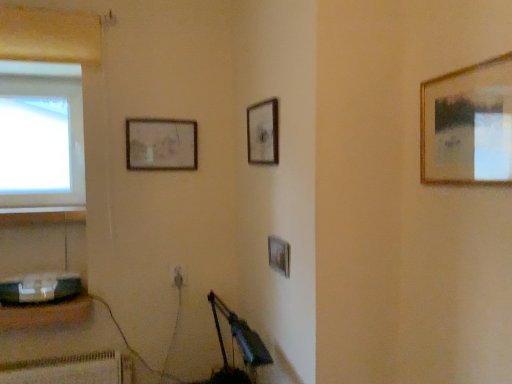
Question: Is metallic gray speaker at lower left smaller than matte wooden picture frame at upper center, placed as the fourth picture frame when sorted from front to back?

Choices:
 (A) no
 (B) yes

Answer: (A)

Question: Is metallic gray speaker at lower left further to the viewer compared to matte wooden picture frame at upper center, placed as the fourth picture frame when sorted from front to back?

Choices:
 (A) no
 (B) yes

Answer: (A)

Question: Does metallic gray speaker at lower left turn towards matte wooden picture frame at upper center, marked as the first picture frame in a left-to-right arrangement?

Choices:
 (A) yes
 (B) no

Answer: (B)

Question: Is metallic gray speaker at lower left taller than matte wooden picture frame at upper center, placed as the fourth picture frame when sorted from front to back?

Choices:
 (A) yes
 (B) no

Answer: (B)

Question: Does metallic gray speaker at lower left have a lesser width compared to matte wooden picture frame at upper center, which ranks as the fourth picture frame in right-to-left order?

Choices:
 (A) yes
 (B) no

Answer: (B)

Question: Considering the positions of wooden picture frame at center, which is the third picture frame in left-to-right order, and matte black toaster at lower left in the image, is wooden picture frame at center, which is the third picture frame in left-to-right order, bigger or smaller than matte black toaster at lower left?

Choices:
 (A) small
 (B) big

Answer: (A)

Question: Considering the positions of point (282, 263) and point (66, 274), is point (282, 263) closer or farther from the camera than point (66, 274)?

Choices:
 (A) closer
 (B) farther

Answer: (A)

Question: Is wooden picture frame at center, the 2th picture frame viewed from the right, in front of or behind matte black toaster at lower left in the image?

Choices:
 (A) front
 (B) behind

Answer: (A)

Question: From their relative heights in the image, would you say wooden picture frame at center, which is counted as the 2th picture frame, starting from the front, is taller or shorter than matte black toaster at lower left?

Choices:
 (A) tall
 (B) short

Answer: (A)

Question: In terms of size, does gold metallic picture frame at upper right, the first picture frame in the front-to-back sequence, appear bigger or smaller than matte black toaster at lower left?

Choices:
 (A) big
 (B) small

Answer: (B)

Question: Does point (461, 148) appear closer or farther from the camera than point (70, 273)?

Choices:
 (A) farther
 (B) closer

Answer: (B)

Question: From a real-world perspective, is gold metallic picture frame at upper right, the 4th picture frame in the back-to-front sequence, positioned above or below matte black toaster at lower left?

Choices:
 (A) above
 (B) below

Answer: (A)

Question: Is gold metallic picture frame at upper right, which appears as the 4th picture frame when viewed from the left, inside or outside of matte black toaster at lower left?

Choices:
 (A) inside
 (B) outside

Answer: (B)

Question: Is gold metallic picture frame at upper right, the 4th picture frame in the back-to-front sequence, bigger or smaller than metallic gray speaker at lower left?

Choices:
 (A) big
 (B) small

Answer: (B)

Question: Is point (422, 155) closer or farther from the camera than point (89, 297)?

Choices:
 (A) closer
 (B) farther

Answer: (A)